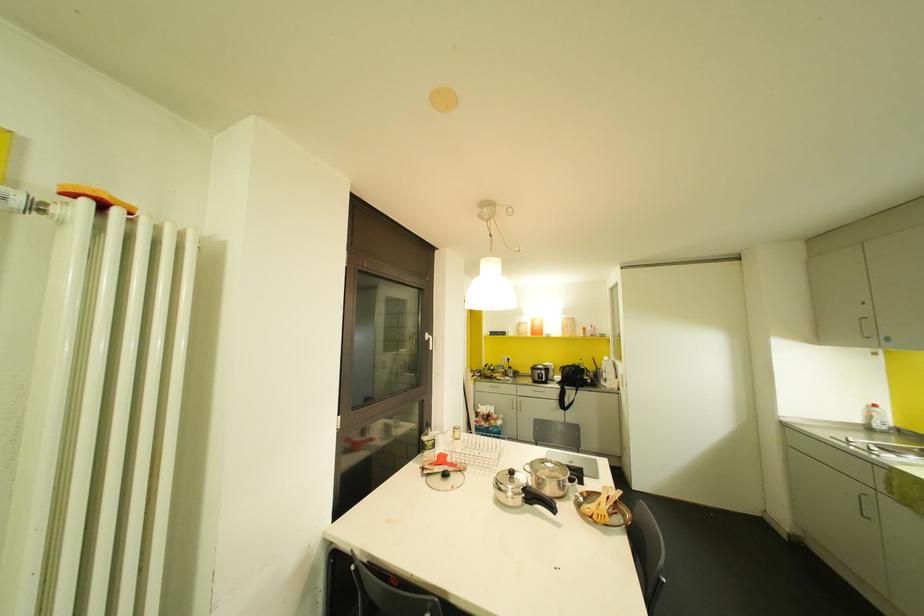
Find where to turn the white window handle. Please return your answer as a coordinate pair (x, y).

(429, 339)